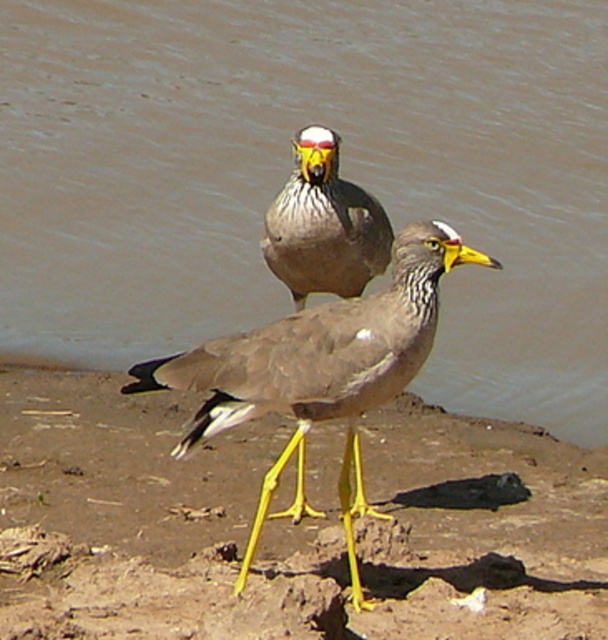
From the picture: You are standing at the origin point of the image. You want to walk to the point marked as point (x=286, y=524). What type of surface will you be walking on when you reach that point?

The point (x=286, y=524) is on yellowish brown mud at center, so you will be walking on yellowish brown mud at center when you reach that point.